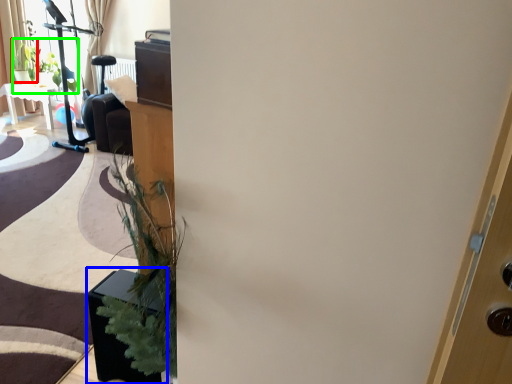
Question: Which object is positioned farthest from plant (highlighted by a red box)? Select from furniture (highlighted by a blue box) and plant (highlighted by a green box).

Choices:
 (A) furniture
 (B) plant

Answer: (A)